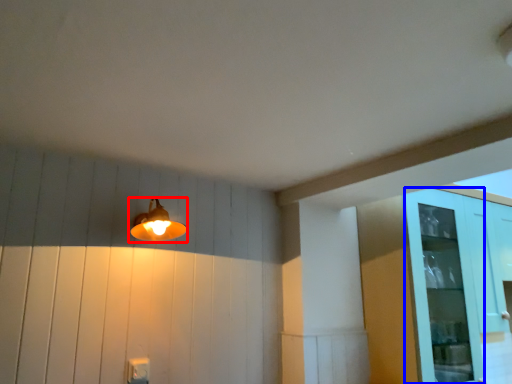
Question: Which of the following is the closest to the observer, lamp (highlighted by a red box) or glass door (highlighted by a blue box)?

Choices:
 (A) lamp
 (B) glass door

Answer: (A)